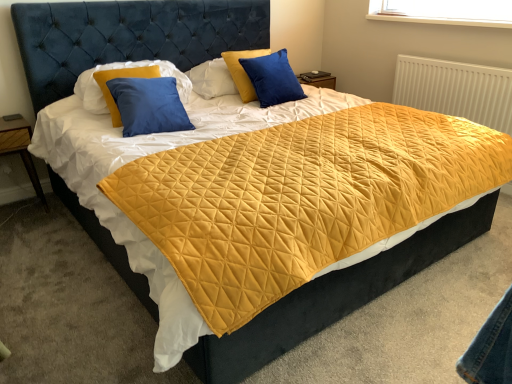
Question: From a real-world perspective, does blue velvet pillow at upper center, which ranks as the 2th pillow in left-to-right order, sit lower than blue matte pillow at upper left, which appears as the 1th pillow when viewed from the left?

Choices:
 (A) yes
 (B) no

Answer: (A)

Question: Can we say blue velvet pillow at upper center, which ranks as the 2th pillow in left-to-right order, lies outside blue matte pillow at upper left, the second pillow from the right?

Choices:
 (A) no
 (B) yes

Answer: (B)

Question: Is blue matte pillow at upper left, the second pillow from the right, inside blue velvet pillow at upper center, the first pillow positioned from the right?

Choices:
 (A) no
 (B) yes

Answer: (A)

Question: From a real-world perspective, is blue velvet pillow at upper center, which ranks as the 2th pillow in left-to-right order, over blue matte pillow at upper left, the second pillow from the right?

Choices:
 (A) yes
 (B) no

Answer: (B)

Question: Is blue velvet pillow at upper center, the first pillow positioned from the right, positioned behind blue matte pillow at upper left, the second pillow from the right?

Choices:
 (A) no
 (B) yes

Answer: (B)

Question: Considering the positions of blue matte pillow at upper left, which appears as the 1th pillow when viewed from the left, and blue velvet pillow at upper center, which ranks as the 2th pillow in left-to-right order, in the image, is blue matte pillow at upper left, which appears as the 1th pillow when viewed from the left, taller or shorter than blue velvet pillow at upper center, which ranks as the 2th pillow in left-to-right order,?

Choices:
 (A) short
 (B) tall

Answer: (A)

Question: Based on their sizes in the image, would you say blue matte pillow at upper left, the second pillow from the right, is bigger or smaller than blue velvet pillow at upper center, the first pillow positioned from the right?

Choices:
 (A) big
 (B) small

Answer: (A)

Question: Is point (110, 64) closer or farther from the camera than point (272, 91)?

Choices:
 (A) closer
 (B) farther

Answer: (A)

Question: In terms of width, does blue matte pillow at upper left, the second pillow from the right, look wider or thinner when compared to blue velvet pillow at upper center, which ranks as the 2th pillow in left-to-right order?

Choices:
 (A) wide
 (B) thin

Answer: (A)

Question: From a real-world perspective, is white textured radiator at upper right physically located above or below wooden at left?

Choices:
 (A) above
 (B) below

Answer: (A)

Question: Would you say white textured radiator at upper right is to the left or to the right of wooden at left in the picture?

Choices:
 (A) right
 (B) left

Answer: (A)

Question: Is white textured radiator at upper right in front of or behind wooden at left in the image?

Choices:
 (A) behind
 (B) front

Answer: (A)

Question: Is white textured radiator at upper right taller or shorter than wooden at left?

Choices:
 (A) tall
 (B) short

Answer: (A)

Question: Is blue velvet pillow at upper center, which ranks as the 2th pillow in left-to-right order, spatially inside white textured radiator at upper right, or outside of it?

Choices:
 (A) inside
 (B) outside

Answer: (B)

Question: Does point (249, 57) appear closer or farther from the camera than point (474, 82)?

Choices:
 (A) closer
 (B) farther

Answer: (A)